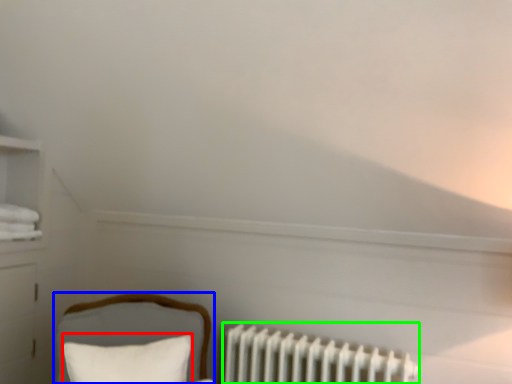
Question: Which object is positioned farthest from pillow (highlighted by a red box)? Select from furniture (highlighted by a blue box) and radiator (highlighted by a green box).

Choices:
 (A) furniture
 (B) radiator

Answer: (B)